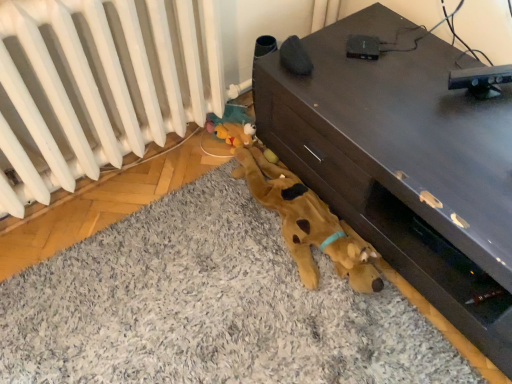
At what (x,y) coordinates should I click in order to perform the action: click on vacant area on top of brown matte tv stand at lower right (from a real-world perspective). Please return your answer as a coordinate pair (x, y). The height and width of the screenshot is (384, 512). Looking at the image, I should click on (415, 94).